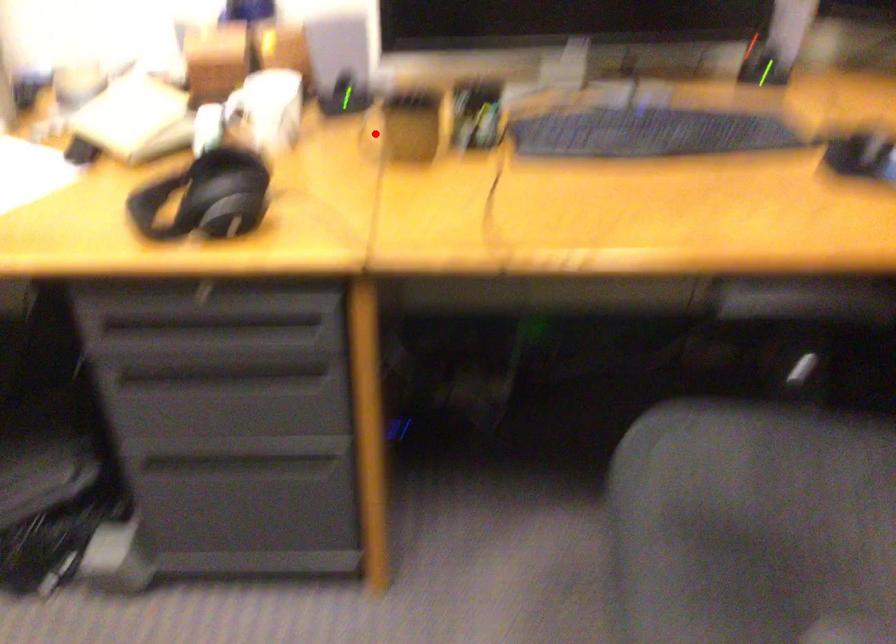
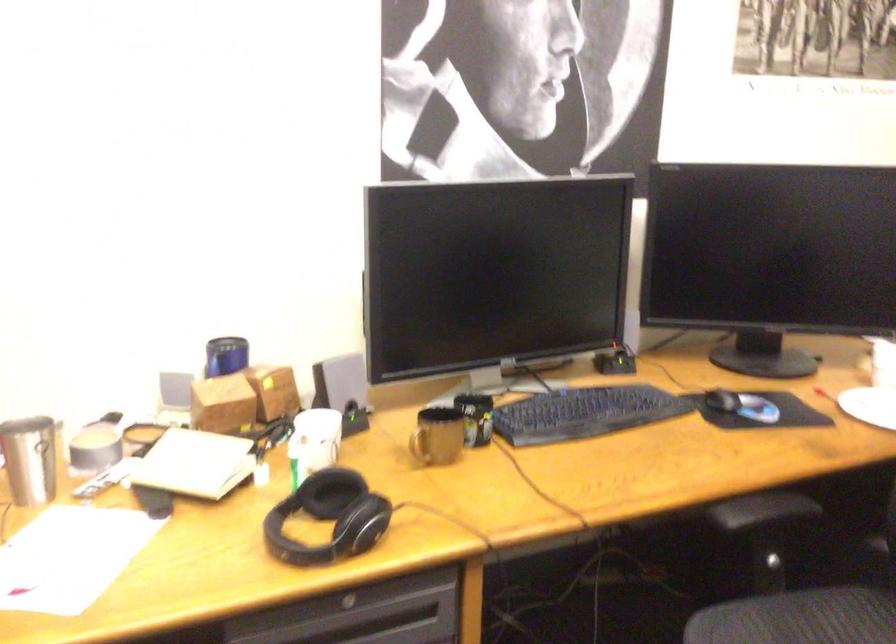
Question: I am providing you with two images of the same scene from different viewpoints. In image1, a red point is highlighted. Considering the same 3D point in image2, which of the following is correct?

Choices:
 (A) It is closer
 (B) It is farther

Answer: (B)